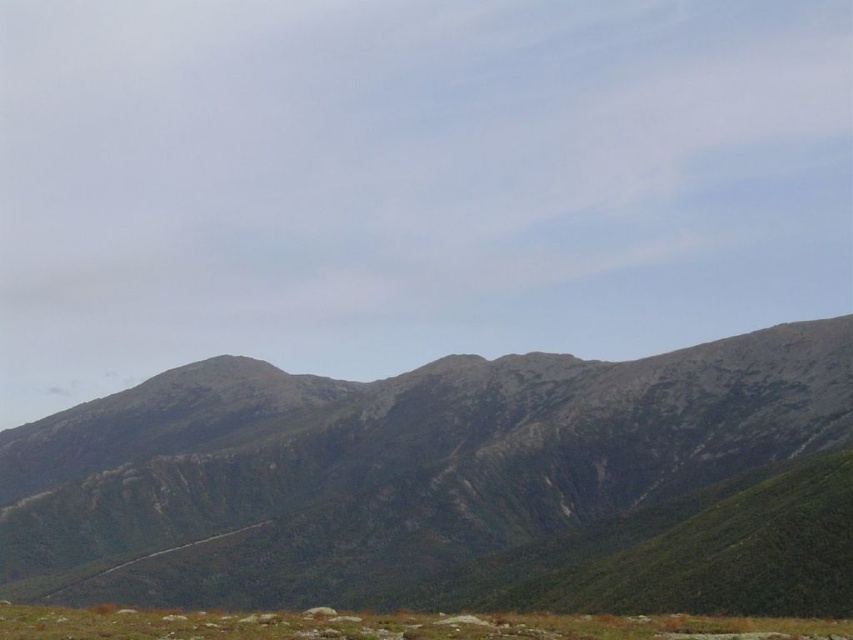
Question: Does rugged gray rock at center appear on the right side of green grassy at lower center?

Choices:
 (A) yes
 (B) no

Answer: (B)

Question: Among these points, which one is farthest from the camera?

Choices:
 (A) (427, 625)
 (B) (276, 442)

Answer: (B)

Question: Does rugged gray rock at center appear under green grassy at lower center?

Choices:
 (A) yes
 (B) no

Answer: (A)

Question: Is rugged gray rock at center wider than green grassy at lower center?

Choices:
 (A) no
 (B) yes

Answer: (B)

Question: Which object appears closest to the camera in this image?

Choices:
 (A) rugged gray rock at center
 (B) green grassy at lower center

Answer: (B)